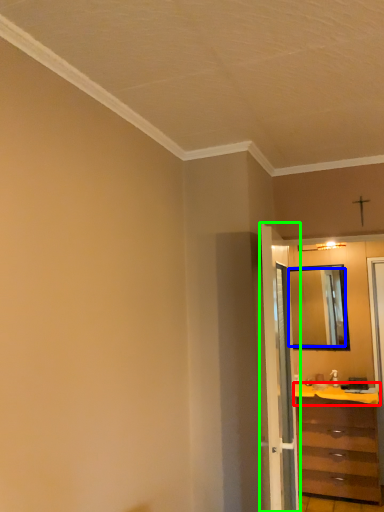
Question: Estimate the real-world distances between objects in this image. Which object is closer to counter top (highlighted by a red box), mirror (highlighted by a blue box) or door (highlighted by a green box)?

Choices:
 (A) mirror
 (B) door

Answer: (A)